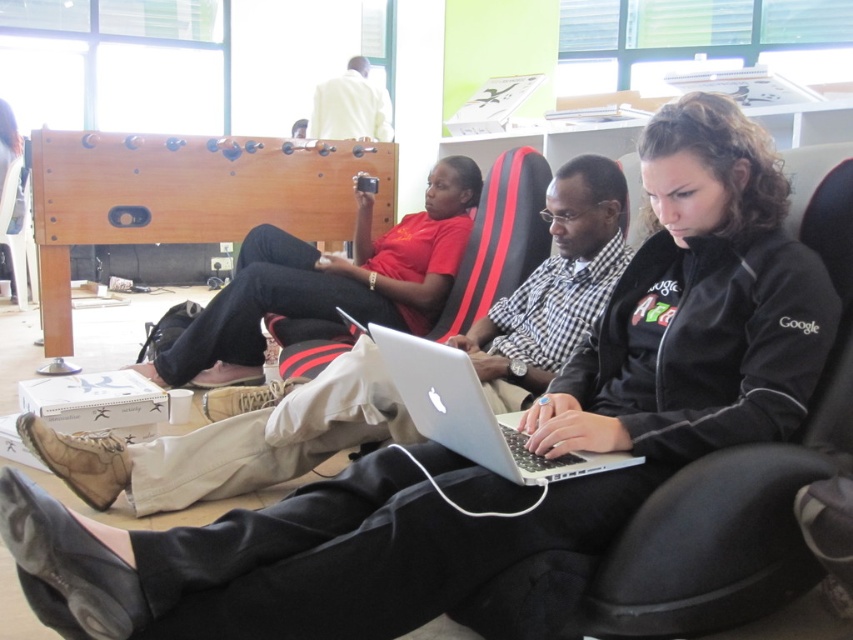
Question: Which is farther from the white matte shirt at upper center?

Choices:
 (A) matte black laptop at center
 (B) silver metallic laptop at center

Answer: (B)

Question: Is matte black laptop at center closer to the viewer compared to black/red/white plastic chair at center?

Choices:
 (A) no
 (B) yes

Answer: (A)

Question: Which of the following is the farthest from the observer?

Choices:
 (A) matte black laptop at center
 (B) silver metallic laptop at center
 (C) black fabric chair at center

Answer: (A)

Question: Is black fabric chair at center further to camera compared to black/red/white plastic chair at center?

Choices:
 (A) no
 (B) yes

Answer: (A)

Question: Can you confirm if silver metallic laptop at center is positioned to the right of white matte shirt at upper center?

Choices:
 (A) no
 (B) yes

Answer: (B)

Question: Which object is closer to the camera taking this photo?

Choices:
 (A) silver metallic laptop at center
 (B) black fabric chair at center
 (C) matte black laptop at center

Answer: (A)